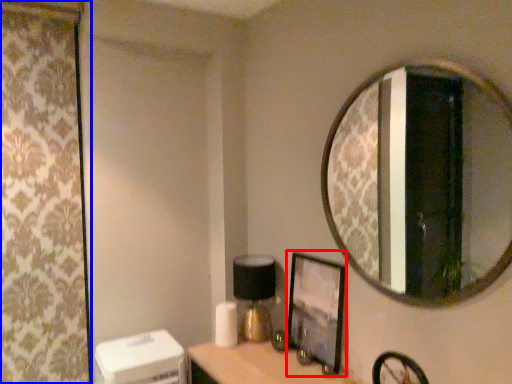
Question: Which object appears closest to the camera in this image, picture frame (highlighted by a red box) or curtain (highlighted by a blue box)?

Choices:
 (A) picture frame
 (B) curtain

Answer: (A)